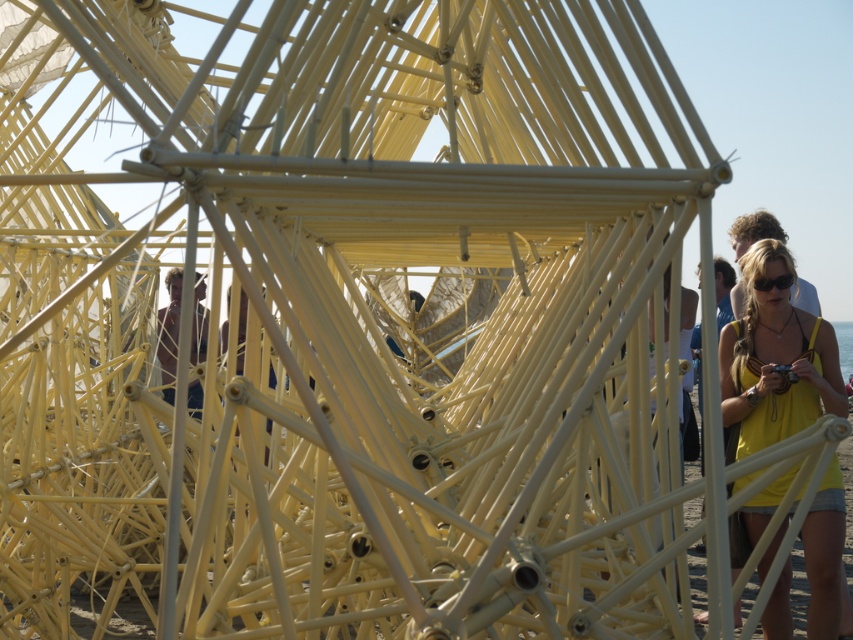
Does yellow fabric top at right have a smaller size compared to black matte sunglasses at center?

No.

Between yellow fabric top at right and black matte sunglasses at center, which one is positioned lower?

yellow fabric top at right is below.

This screenshot has width=853, height=640. Find the location of `yellow fabric top at right`. yellow fabric top at right is located at coordinates (775, 358).